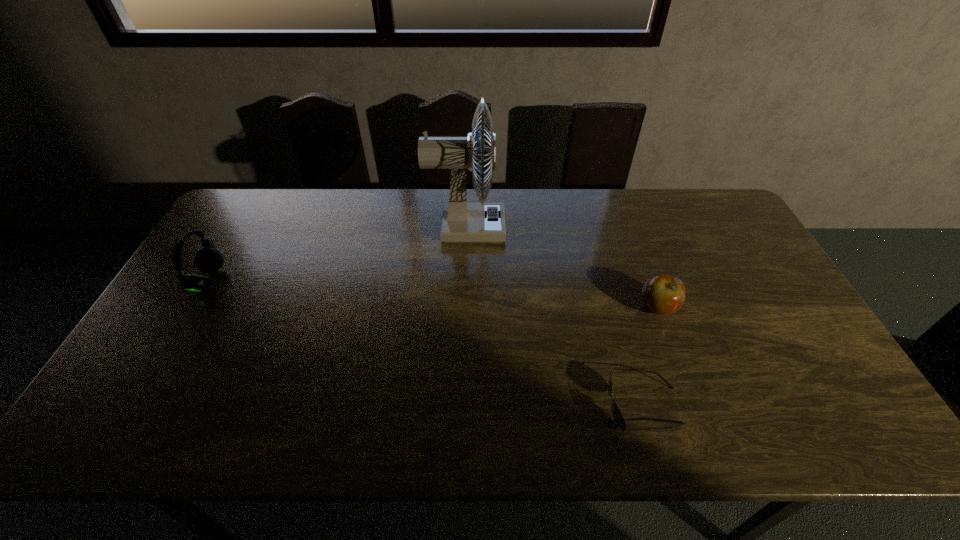
Where is `free space located 0.070m on the front-facing side of the nearest object`? free space located 0.070m on the front-facing side of the nearest object is located at coordinates (578, 406).

At what (x,y) coordinates should I click in order to perform the action: click on free point located 0.300m on the front-facing side of the nearest object. Please return your answer as a coordinate pair (x, y). The image size is (960, 540). Looking at the image, I should click on (480, 406).

Identify the location of vacant space situated on the front-facing side of the nearest object. The height and width of the screenshot is (540, 960). (454, 406).

Locate an element on the screen. object that is at the far edge is located at coordinates (461, 222).

At what (x,y) coordinates should I click in order to perform the action: click on object present at the near edge. Please return your answer as a coordinate pair (x, y). Image resolution: width=960 pixels, height=540 pixels. Looking at the image, I should click on (617, 415).

The height and width of the screenshot is (540, 960). I want to click on object that is at the left edge, so click(208, 259).

The width and height of the screenshot is (960, 540). In order to click on vacant space at the far edge of the desktop in this screenshot , I will do `click(352, 221)`.

You are a GUI agent. You are given a task and a screenshot of the screen. Output one action in this format:
    pyautogui.click(x=<x>, y=<y>)
    Task: Click on the free spot at the near edge of the desktop
    This screenshot has height=540, width=960.
    Given the screenshot: What is the action you would take?
    pyautogui.click(x=287, y=429)

You are a GUI agent. You are given a task and a screenshot of the screen. Output one action in this format:
    pyautogui.click(x=<x>, y=<y>)
    Task: Click on the free space at the left edge
    
    Given the screenshot: What is the action you would take?
    pyautogui.click(x=228, y=233)

The width and height of the screenshot is (960, 540). In the image, there is a desktop. Find the location of `blank space at the right edge`. blank space at the right edge is located at coordinates (746, 313).